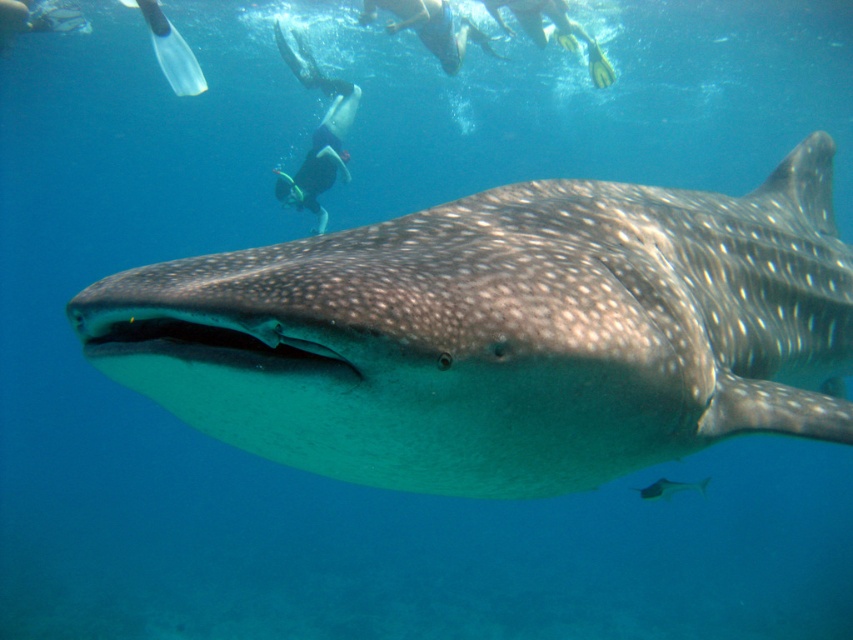
Question: From the image, what is the correct spatial relationship of black wetsuit at upper center in relation to shiny silver fish at center?

Choices:
 (A) above
 (B) below

Answer: (A)

Question: Which point is closer to the camera taking this photo?

Choices:
 (A) (397, 13)
 (B) (659, 496)

Answer: (B)

Question: Which of the following is the closest to the observer?

Choices:
 (A) (637, 488)
 (B) (306, 460)
 (C) (326, 156)

Answer: (B)

Question: Among these points, which one is nearest to the camera?

Choices:
 (A) (344, 116)
 (B) (448, 52)
 (C) (659, 483)
 (D) (196, 259)

Answer: (D)

Question: Does speckled skin shark at center appear over black wetsuit at upper center?

Choices:
 (A) no
 (B) yes

Answer: (A)

Question: Can you confirm if black wetsuit at center is positioned to the right of shiny silver fish at center?

Choices:
 (A) no
 (B) yes

Answer: (A)